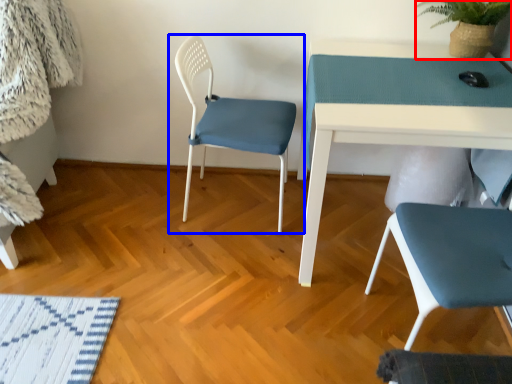
Question: Which object is closer to the camera taking this photo, plant (highlighted by a red box) or chair (highlighted by a blue box)?

Choices:
 (A) plant
 (B) chair

Answer: (B)